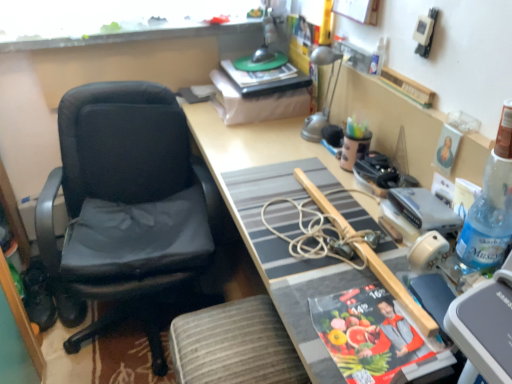
Question: Considering the relative positions of transparent glass window at upper center and wooden desk at center in the image provided, is transparent glass window at upper center to the left or to the right of wooden desk at center?

Choices:
 (A) left
 (B) right

Answer: (A)

Question: Is transparent glass window at upper center in front of or behind wooden desk at center in the image?

Choices:
 (A) behind
 (B) front

Answer: (A)

Question: Which object is the closest to the wooden desk at center?

Choices:
 (A) gray fabric stool at lower center
 (B) wooden picture frame at upper center
 (C) transparent glass window at upper center
 (D) matte paper magazine at lower right
 (E) silver metallic lamp at upper right

Answer: (D)

Question: Which of these objects is positioned farthest from the wooden picture frame at upper center?

Choices:
 (A) blue plastic bottle at right, the first bottle viewed from the right
 (B) wooden desk at center
 (C) transparent glass window at upper center
 (D) black leather chair at left
 (E) matte paper magazine at lower right

Answer: (D)